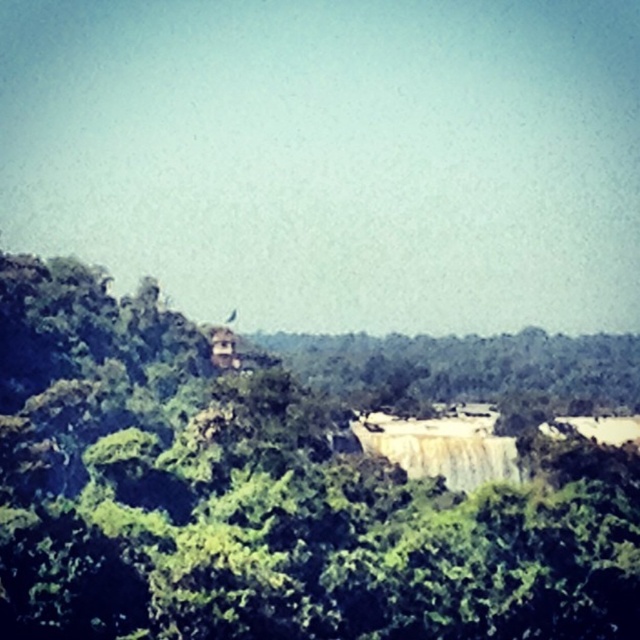
Does green leafy tree at center have a larger size compared to white smooth waterfall at center?

Answer: Indeed, green leafy tree at center has a larger size compared to white smooth waterfall at center.

Describe the element at coordinates (264, 499) in the screenshot. I see `green leafy tree at center` at that location.

I want to click on green leafy tree at center, so coord(264,499).